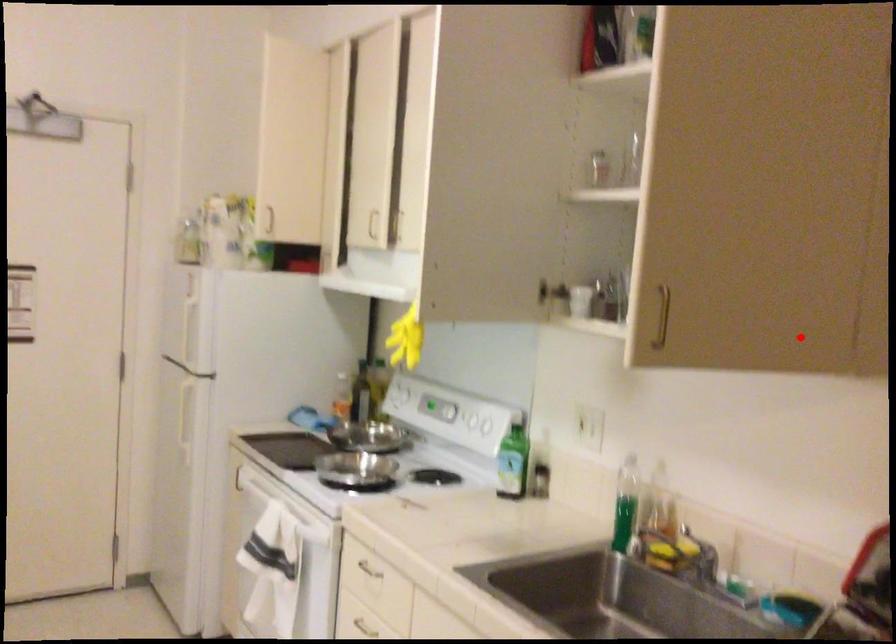
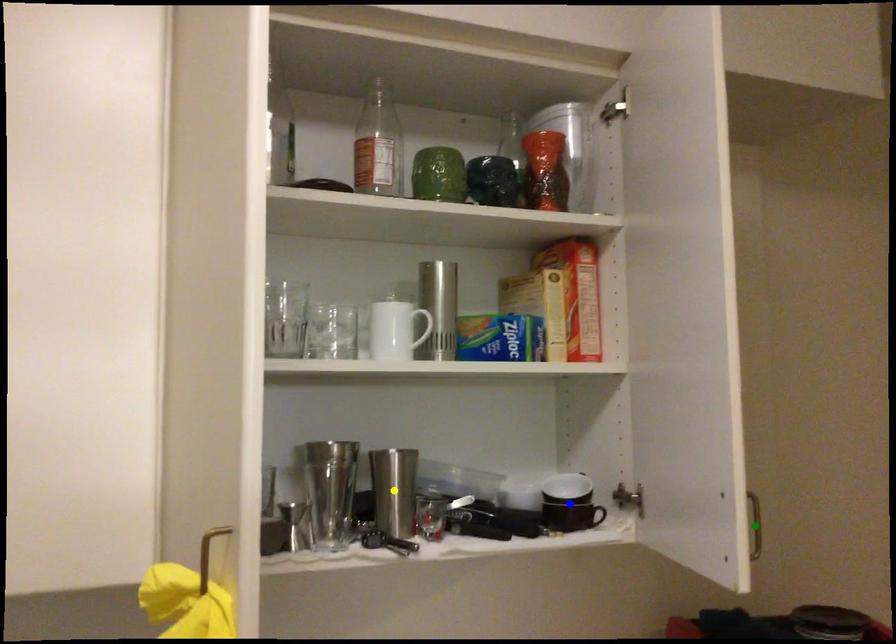
Question: I am providing you with two images of the same scene from different viewpoints. A red point is marked on the first image. You are given multiple points on the second image. In image 2, which mark is for the same physical point as the one in image 1?

Choices:
 (A) blue point
 (B) yellow point
 (C) green point

Answer: (A)